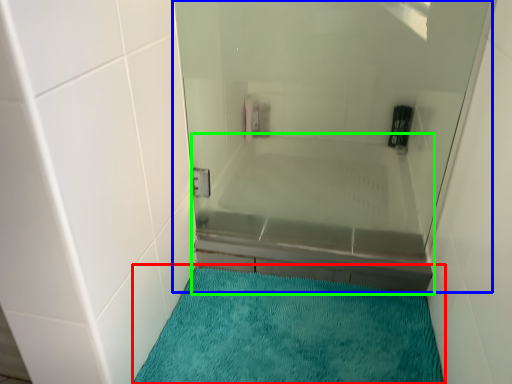
Question: Which object is the closest to the bath mat (highlighted by a red box)? Choose among these: shower door (highlighted by a blue box) or bathtub (highlighted by a green box).

Choices:
 (A) shower door
 (B) bathtub

Answer: (B)